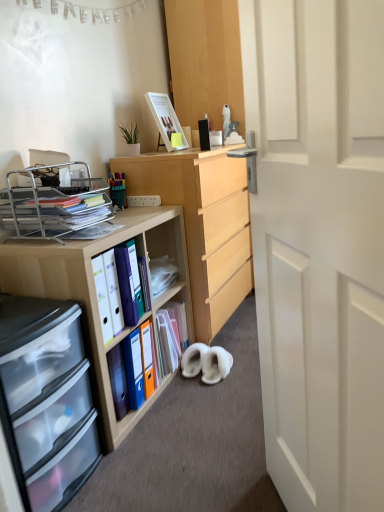
Question: Visually, is matte plastic folders at center left, the 1th book in the front-to-back sequence, positioned to the left or to the right of matte wooden picture frame at upper center?

Choices:
 (A) left
 (B) right

Answer: (A)

Question: Considering the positions of matte plastic folders at center left, marked as the 2th book in a back-to-front arrangement, and matte wooden picture frame at upper center in the image, is matte plastic folders at center left, marked as the 2th book in a back-to-front arrangement, taller or shorter than matte wooden picture frame at upper center?

Choices:
 (A) tall
 (B) short

Answer: (B)

Question: Based on their relative distances, which object is nearer to the clear plastic drawers at lower left?

Choices:
 (A) matte plastic folder at center, marked as the second book in a front-to-back arrangement
 (B) wooden desk at left, which ranks as the first desk in front-to-back order
 (C) white suede slippers at lower center, which is the 1th footwear from left to right
 (D) matte wooden picture frame at upper center
 (E) green matte plant at upper left

Answer: (B)

Question: Based on their relative distances, which object is farther from the matte plastic folders at center left, marked as the 2th book in a back-to-front arrangement?

Choices:
 (A) matte plastic folder at center, positioned as the first book in back-to-front order
 (B) white suede slippers at lower center, which is the 1th footwear from left to right
 (C) metallic silver organizer at left
 (D) white matte door at center
 (E) wooden desk at center, which ranks as the 2th desk in front-to-back order

Answer: (D)